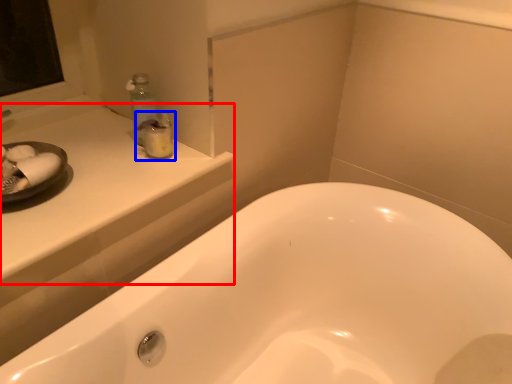
Question: Which of the following is the closest to the observer, counter top (highlighted by a red box) or toiletry (highlighted by a blue box)?

Choices:
 (A) counter top
 (B) toiletry

Answer: (A)